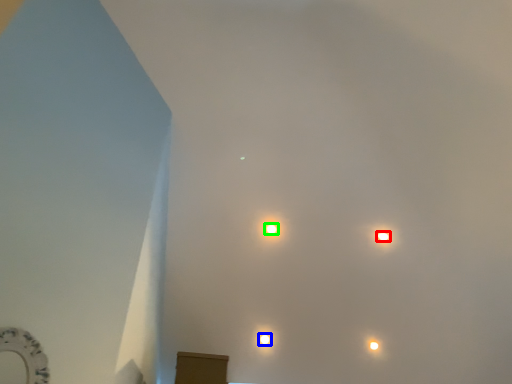
Question: Which object is the farthest from lamp (highlighted by a red box)? Choose among these: lamp (highlighted by a blue box) or lamp (highlighted by a green box).

Choices:
 (A) lamp
 (B) lamp

Answer: (A)